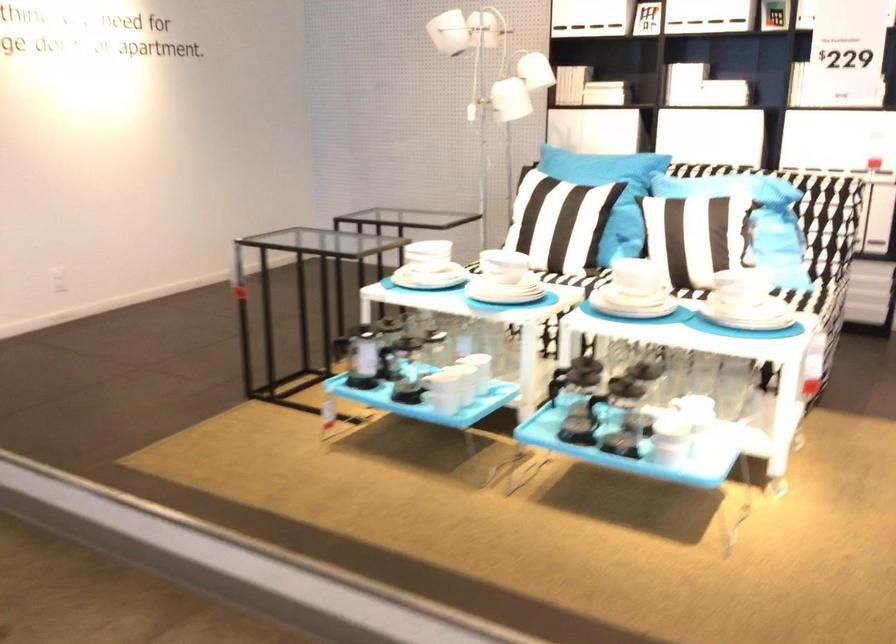
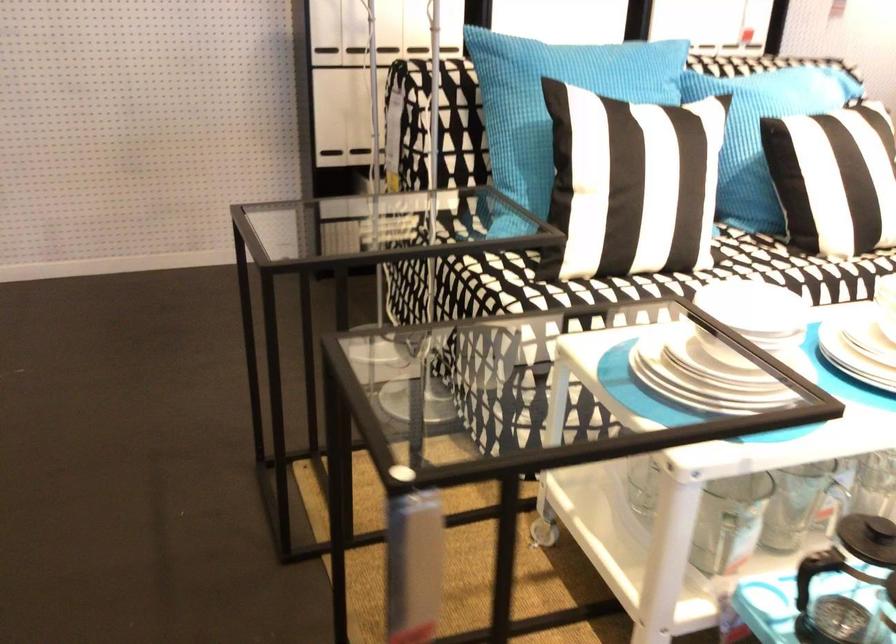
In the second image, find the point that corresponds to point (549, 131) in the first image.

(325, 46)